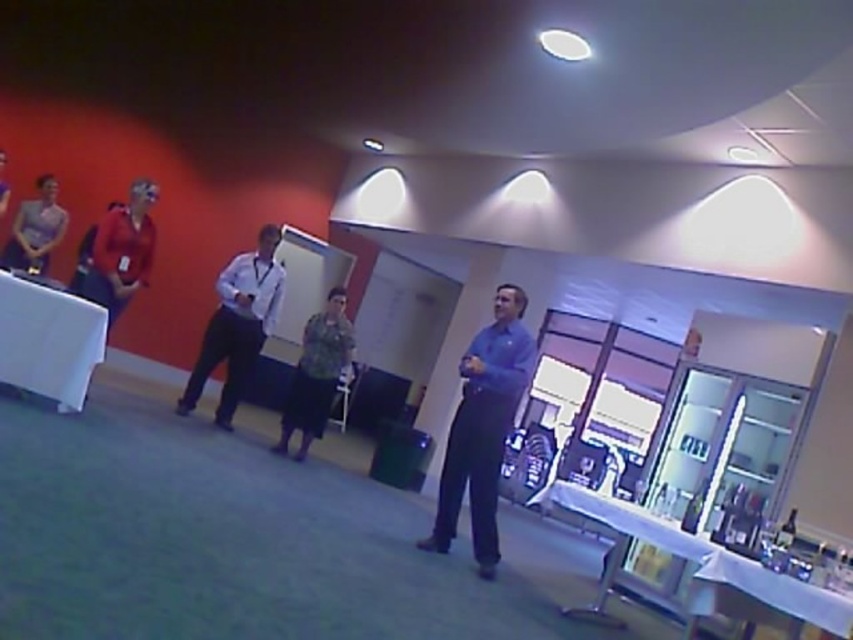
Question: Among these points, which one is farthest from the camera?

Choices:
 (A) (434, 531)
 (B) (276, 268)

Answer: (B)

Question: Can you confirm if white shirt at center is smaller than matte purple dress at left?

Choices:
 (A) yes
 (B) no

Answer: (B)

Question: Among these points, which one is farthest from the camera?

Choices:
 (A) (341, 364)
 (B) (77, 381)
 (C) (683, 554)
 (D) (49, 180)

Answer: (A)

Question: Is clear glass table at lower right below white shirt at center?

Choices:
 (A) no
 (B) yes

Answer: (B)

Question: Among these points, which one is farthest from the camera?

Choices:
 (A) (120, 260)
 (B) (471, 396)
 (C) (49, 246)

Answer: (C)

Question: Is the position of camouflage fabric shirt at center more distant than that of matte red shirt at left?

Choices:
 (A) yes
 (B) no

Answer: (A)